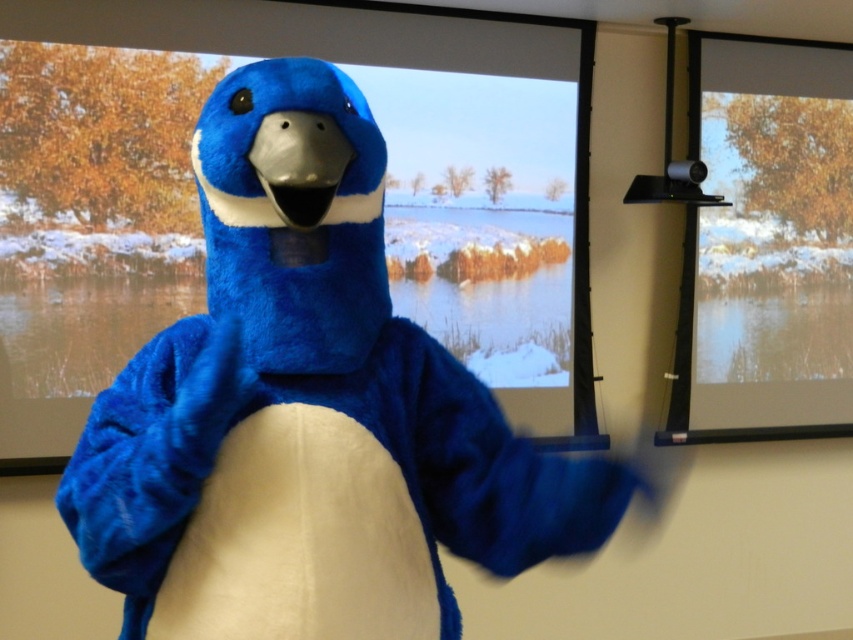
Question: Is blue plush penguin at center above transparent glass window at upper right?

Choices:
 (A) no
 (B) yes

Answer: (A)

Question: Does blue plush penguin at center have a lesser width compared to transparent glass window at upper right?

Choices:
 (A) no
 (B) yes

Answer: (B)

Question: Which point is closer to the camera taking this photo?

Choices:
 (A) (421, 602)
 (B) (834, 358)

Answer: (A)

Question: Does blue plush penguin at center have a larger size compared to transparent glass window at upper right?

Choices:
 (A) yes
 (B) no

Answer: (B)

Question: Which point appears closest to the camera in this image?

Choices:
 (A) (688, 248)
 (B) (389, 627)

Answer: (B)

Question: Which point is farther from the camera taking this photo?

Choices:
 (A) (683, 442)
 (B) (131, 481)

Answer: (A)